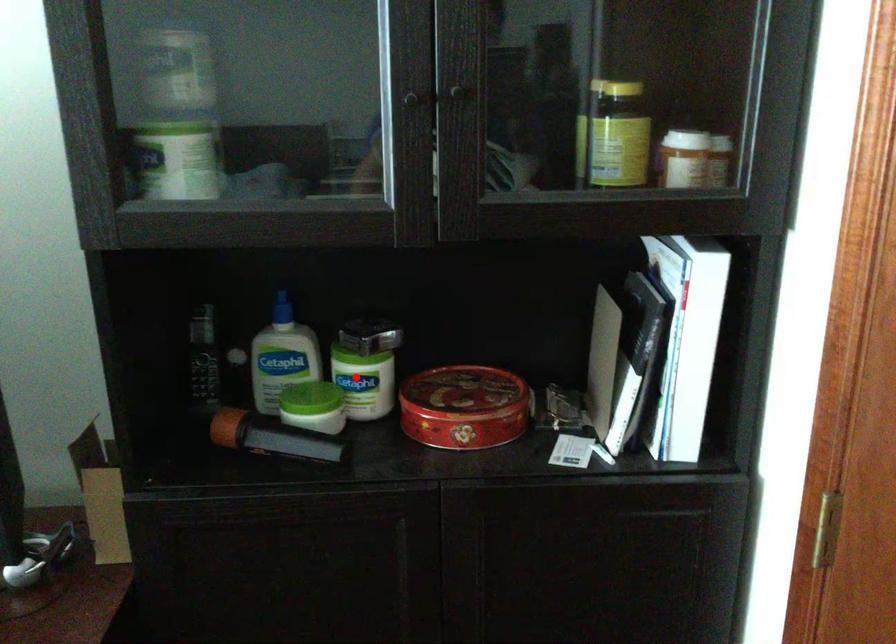
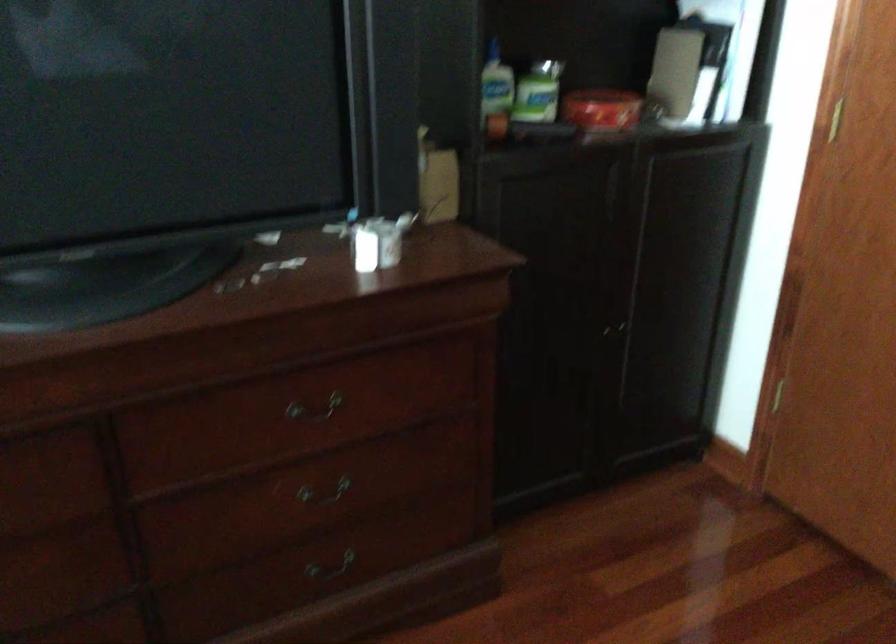
Question: I am providing you with two images of the same scene from different viewpoints. Image1 has a red point marked. In image2, the corresponding 3D location appears at what relative position? Reply with the corresponding letter.

Choices:
 (A) Closer
 (B) Farther

Answer: (B)